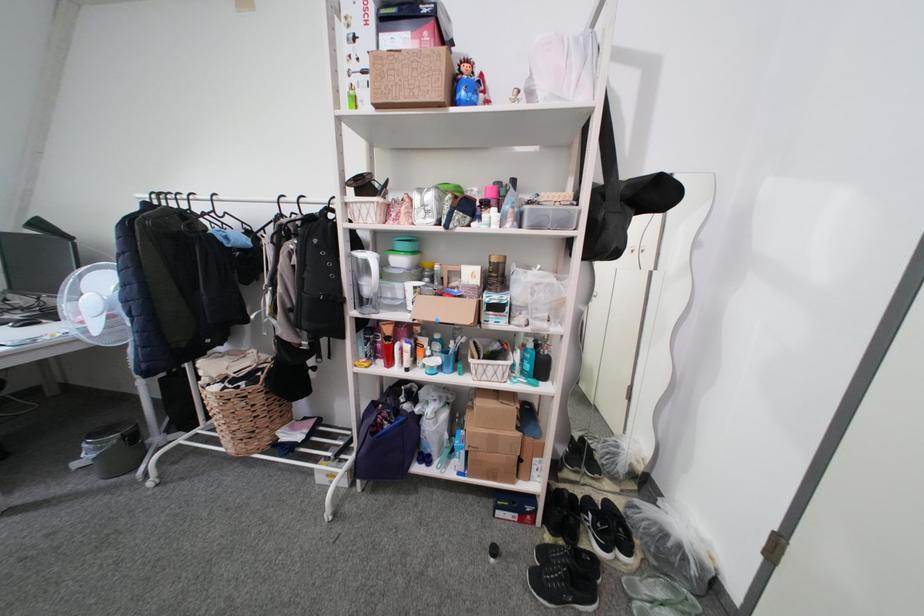
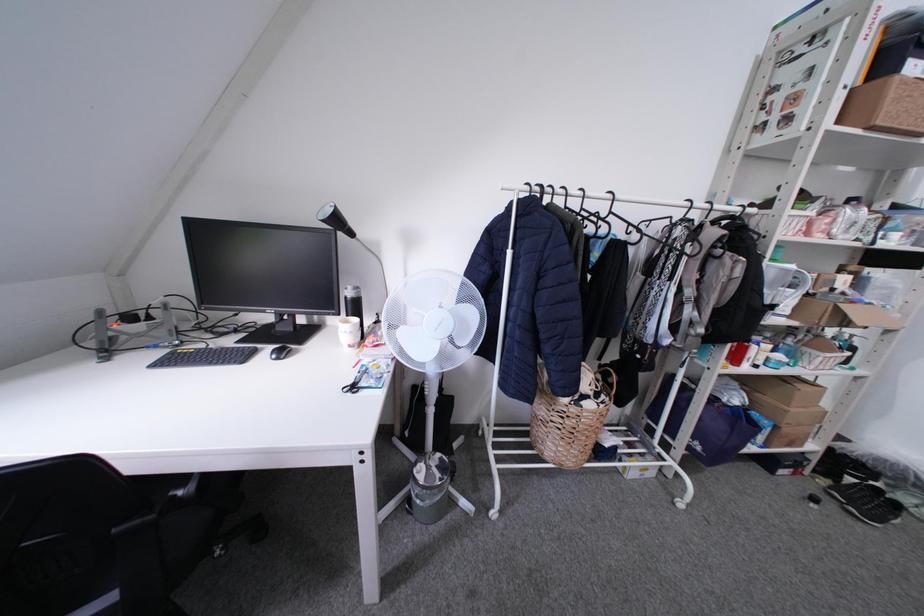
Question: Which direction would the cameraman need to move to produce the second image? Reply with the corresponding letter.

Choices:
 (A) Left
 (B) Right
 (C) Forward
 (D) Backward

Answer: (A)